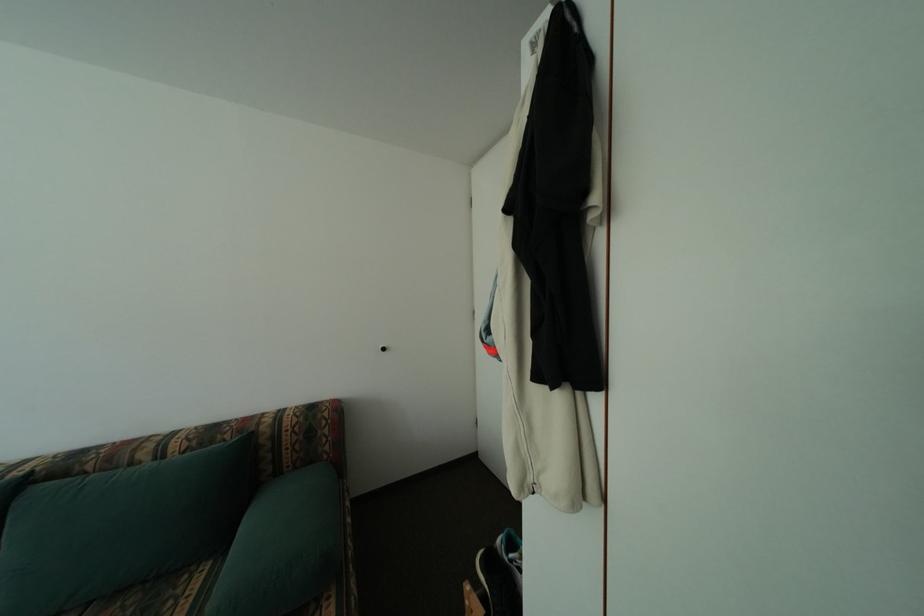
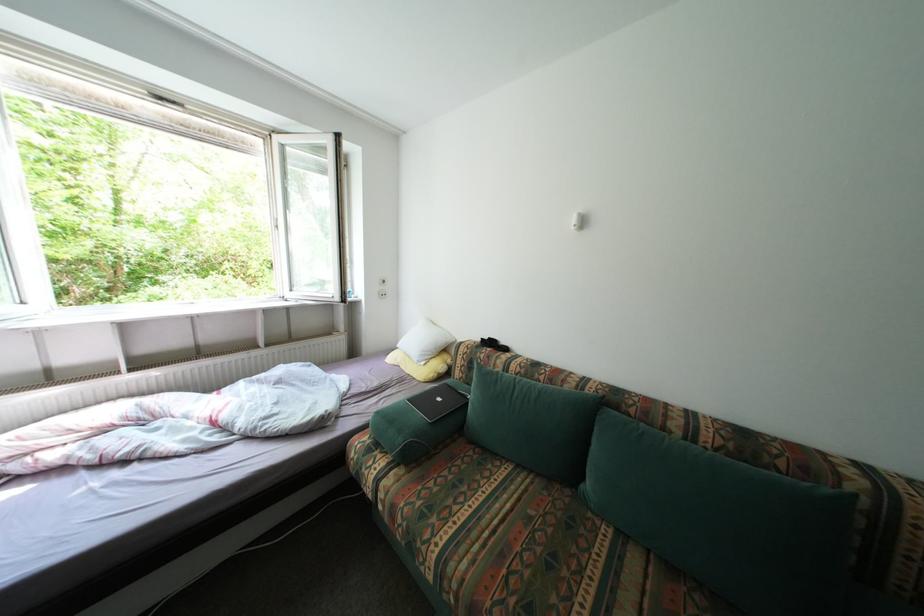
Question: Based on the continuous images, in which direction is the camera rotating? Reply with the corresponding letter.

Choices:
 (A) Left
 (B) Right
 (C) Up
 (D) Down

Answer: (A)